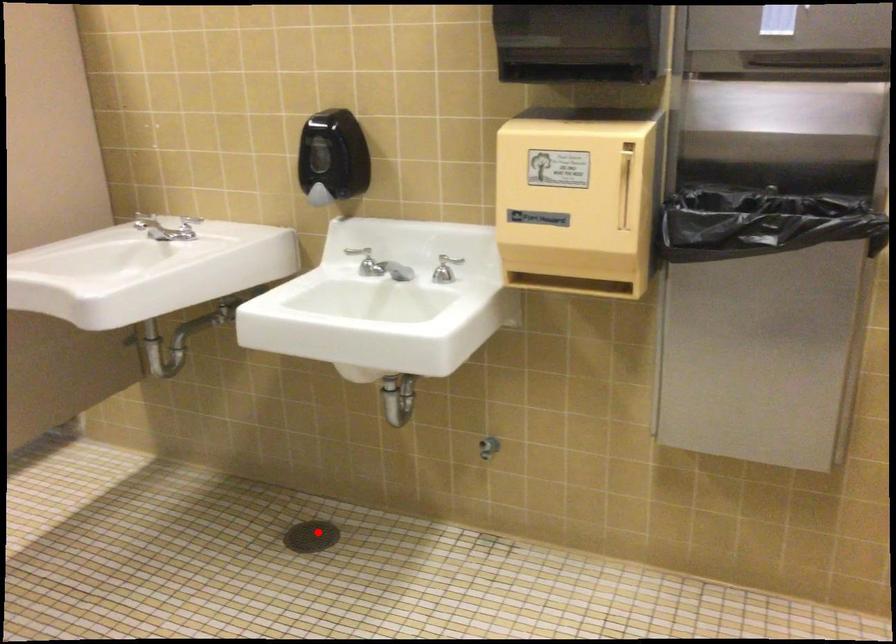
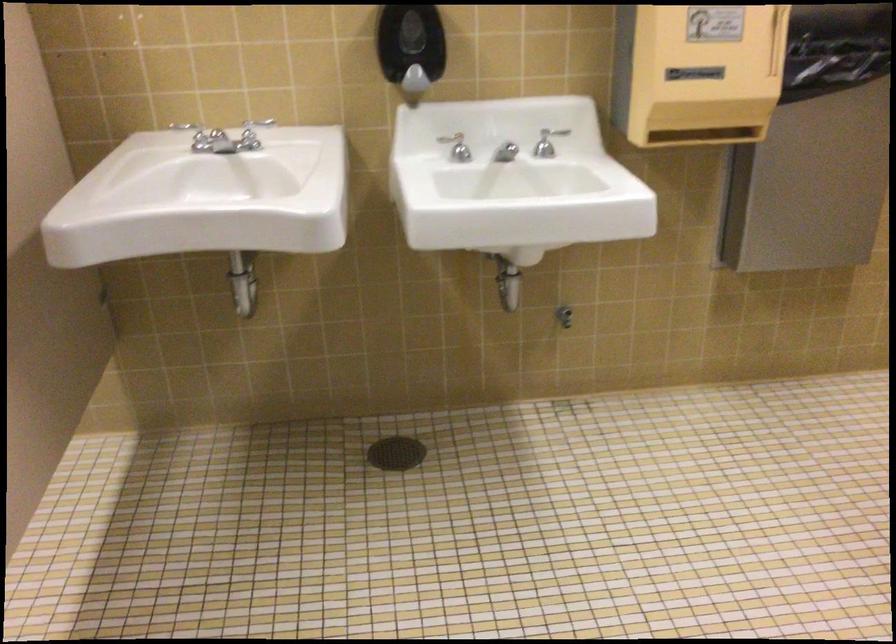
In the second image, find the point that corresponds to the highlighted location in the first image.

(395, 453)